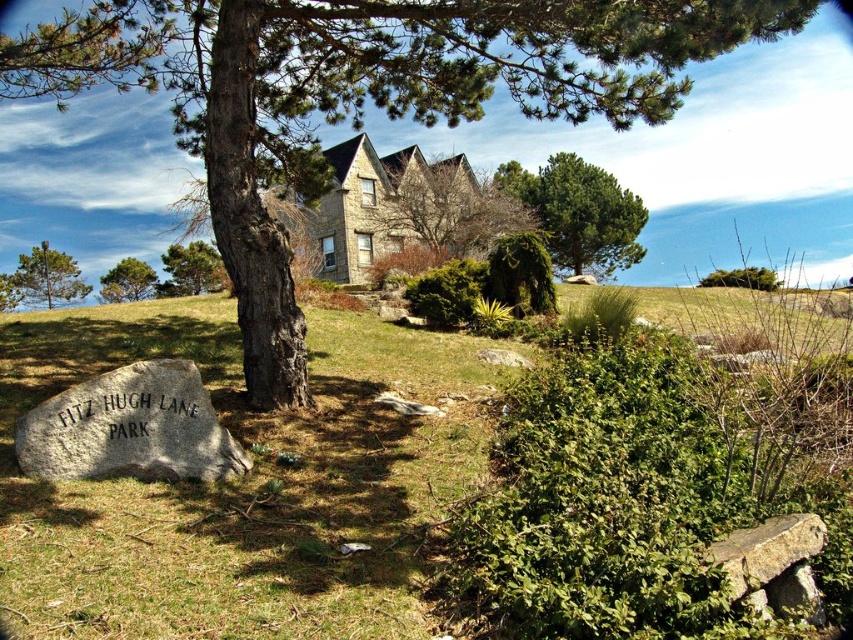
Does brown stone house at upper center have a smaller size compared to green leafy bush at upper right?

Yes, brown stone house at upper center is smaller than green leafy bush at upper right.

Does brown stone house at upper center appear on the left side of green leafy bush at upper right?

Correct, you'll find brown stone house at upper center to the left of green leafy bush at upper right.

Is point (502, 236) positioned in front of point (717, 276)?

Yes, point (502, 236) is closer to viewer.

Find the location of `brown stone house at upper center`. brown stone house at upper center is located at coordinates (445, 208).

Based on the photo, does green leafy tree at upper center appear over green leafy bush at upper right?

Yes.

Does green leafy tree at upper center appear on the right side of green leafy bush at upper right?

Incorrect, green leafy tree at upper center is not on the right side of green leafy bush at upper right.

This screenshot has height=640, width=853. What do you see at coordinates (579, 212) in the screenshot?
I see `green leafy tree at upper center` at bounding box center [579, 212].

This screenshot has width=853, height=640. I want to click on green leafy tree at upper center, so click(579, 212).

Based on the photo, how far apart are green grassy at lower left and green rough bark tree at upper center?

green grassy at lower left is 14.35 meters away from green rough bark tree at upper center.

Is point (12, 593) positioned behind point (200, 268)?

That is False.

Locate an element on the screen. green grassy at lower left is located at coordinates (247, 483).

Locate an element on the screen. The width and height of the screenshot is (853, 640). green grassy at lower left is located at coordinates (247, 483).